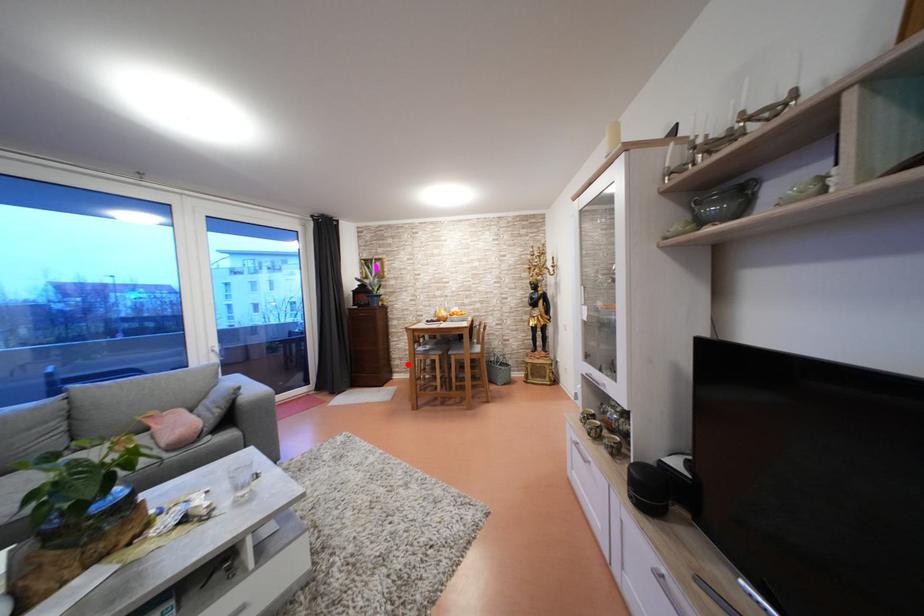
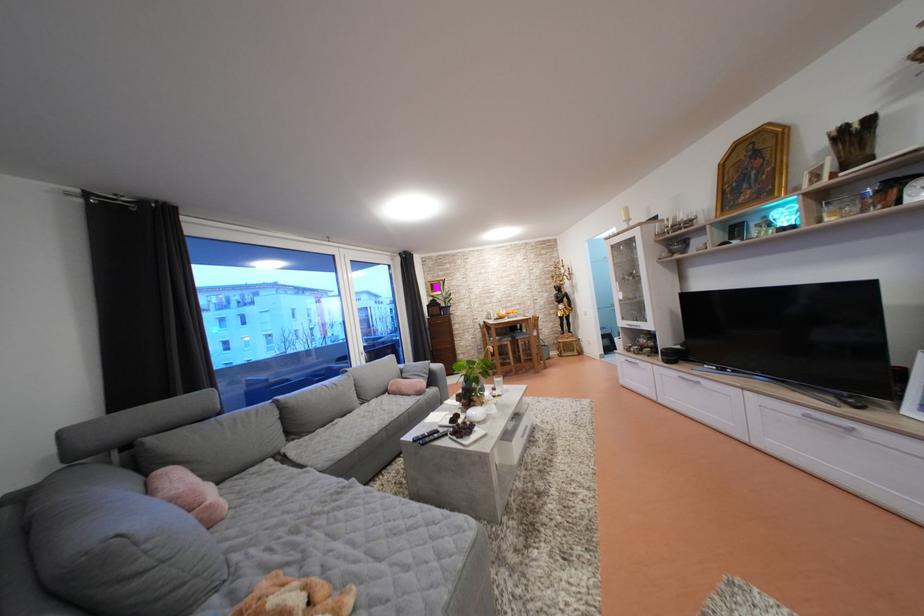
Question: I am providing you with two images of the same scene from different viewpoints. A red point is shown in image1. For the corresponding object point in image2, is it positioned nearer or farther from the camera?

Choices:
 (A) Nearer
 (B) Farther

Answer: (A)